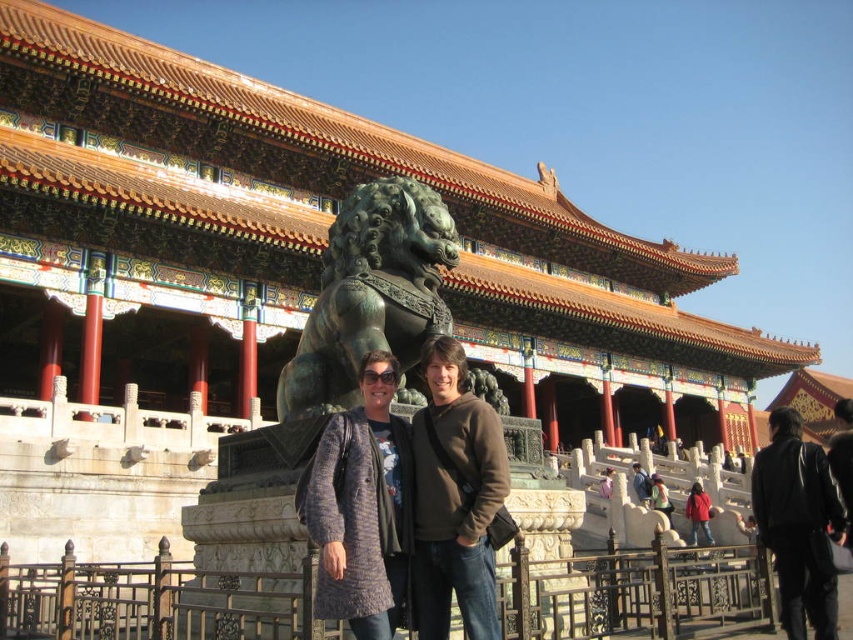
Question: Based on their relative distances, which object is nearer to the matte black jacket at center?

Choices:
 (A) matte gray sweater at center
 (B) brown metal railing at lower center

Answer: (B)

Question: Can you confirm if matte gray sweater at center is positioned above brown leather jacket at center?

Choices:
 (A) yes
 (B) no

Answer: (A)

Question: Among these objects, which one is nearest to the camera?

Choices:
 (A) matte black jacket at center
 (B) brown metal railing at lower center
 (C) matte red jacket at lower right

Answer: (B)

Question: Which is nearer to the black leather jacket at lower right?

Choices:
 (A) matte gray sweater at center
 (B) matte black jacket at center
 (C) matte red jacket at lower right

Answer: (C)

Question: Is brown metal railing at lower center positioned behind matte black jacket at center?

Choices:
 (A) no
 (B) yes

Answer: (A)

Question: Can you confirm if black leather jacket at lower right is bigger than brown leather jacket at center?

Choices:
 (A) no
 (B) yes

Answer: (B)